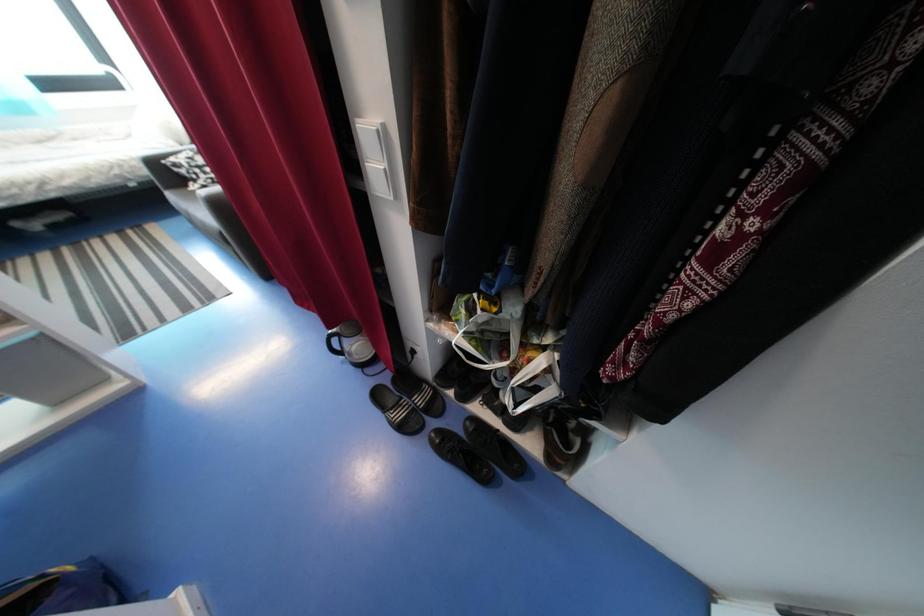
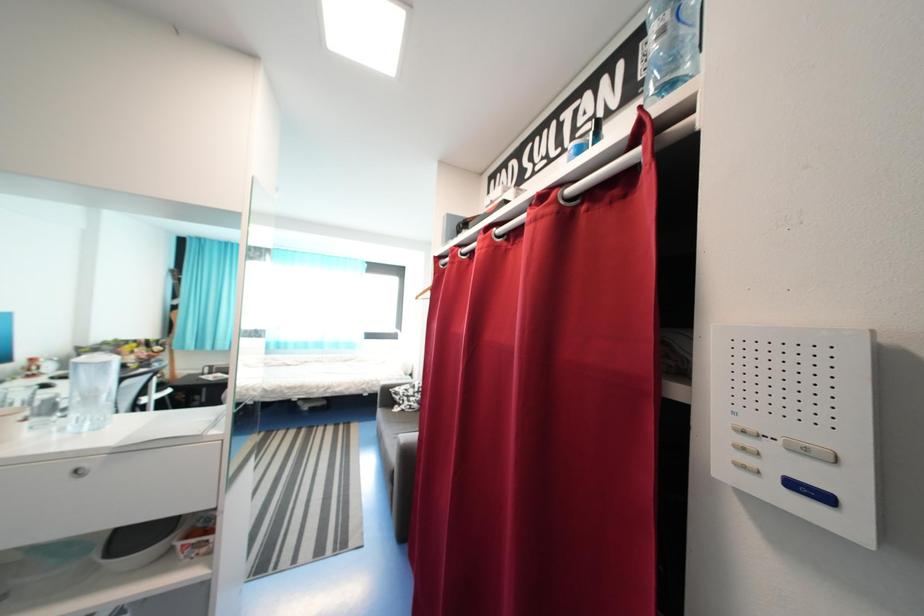
Based on the continuous images, in which direction is the camera rotating?

The camera's rotation is toward left-up.